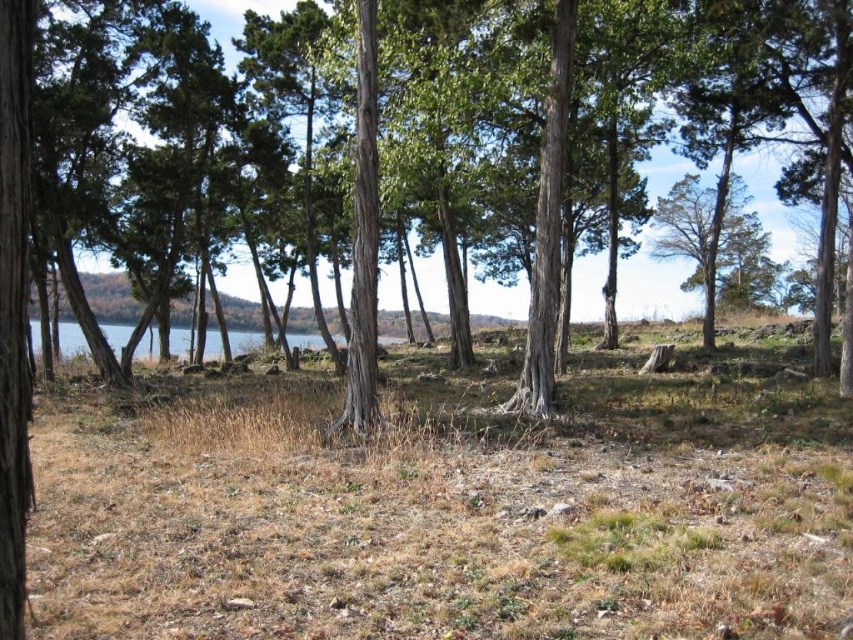
Can you confirm if brown dry grass at center is wider than smooth bark tree at center?

Indeed, brown dry grass at center has a greater width compared to smooth bark tree at center.

Is brown dry grass at center to the left of smooth bark tree at center from the viewer's perspective?

Correct, you'll find brown dry grass at center to the left of smooth bark tree at center.

Where is `brown dry grass at center`? The image size is (853, 640). brown dry grass at center is located at coordinates (444, 509).

This screenshot has height=640, width=853. Find the location of `brown dry grass at center`. brown dry grass at center is located at coordinates (444, 509).